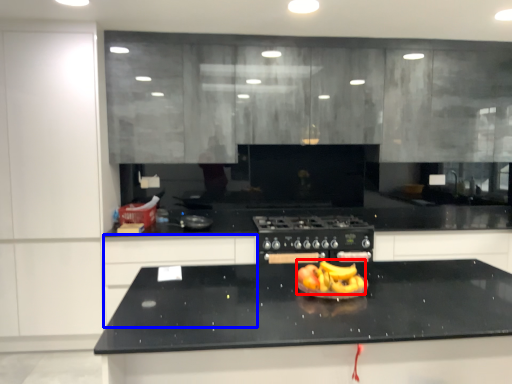
Question: Among these objects, which one is nearest to the camera, fruit dish (highlighted by a red box) or cabinetry (highlighted by a blue box)?

Choices:
 (A) fruit dish
 (B) cabinetry

Answer: (A)